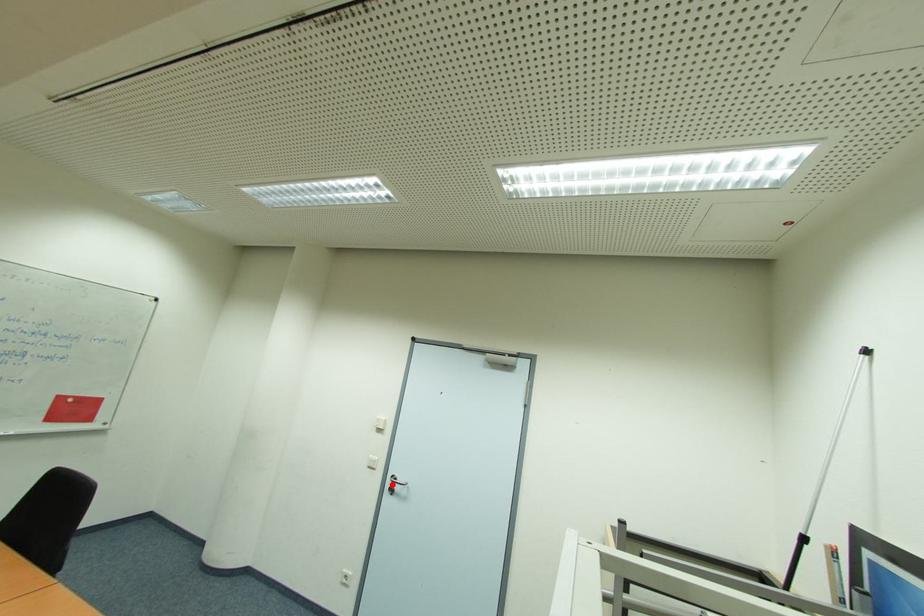
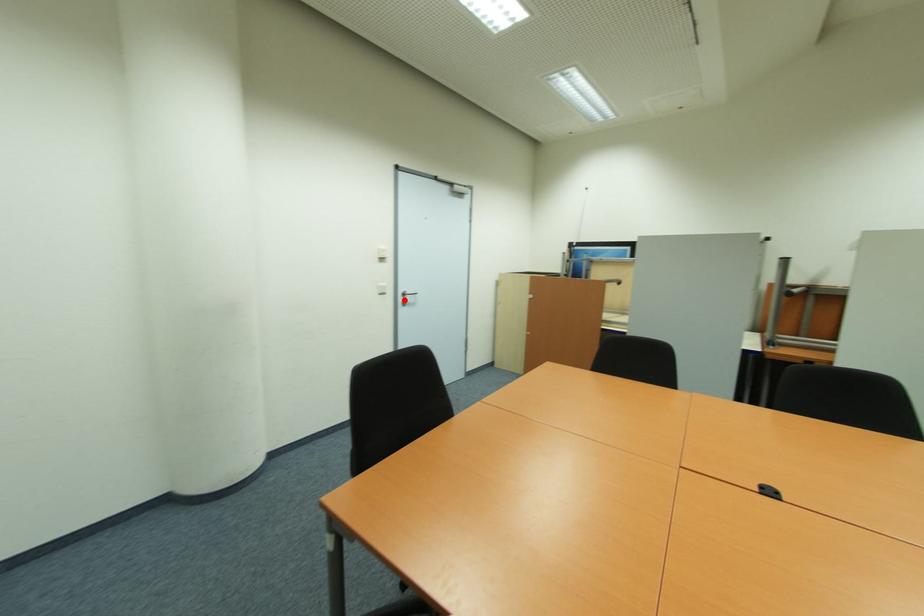
I am providing you with two images of the same scene from different viewpoints. A red point is marked on the first image and another point is marked on the second image. Are the points marked in image1 and image2 representing the same 3D position?

Yes